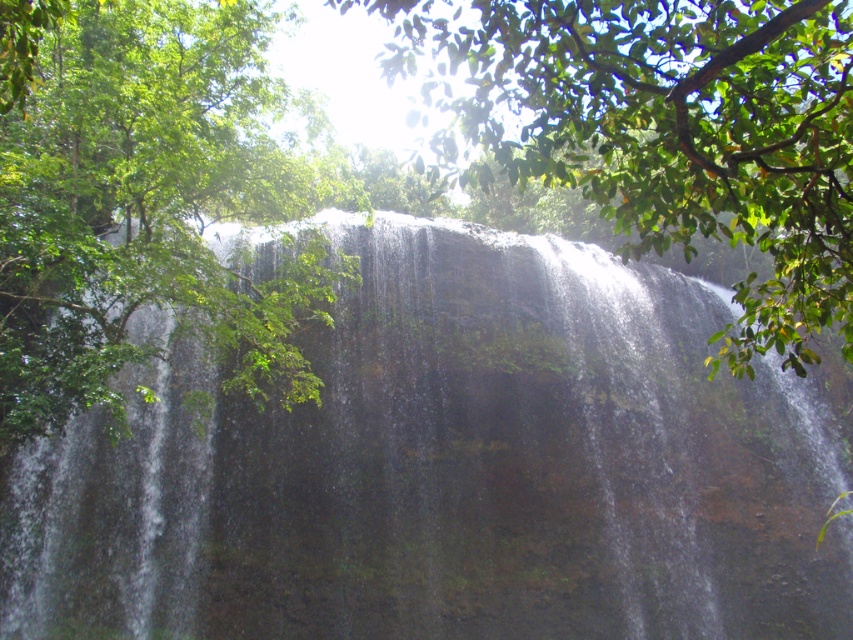
You are a photographer planning to capture the waterfall and the tree in the scene. Which object, the clear water at center or the green leafy tree at upper left, will occupy more space in your photo?

The clear water at center occupies more space in the photo because it is bigger than the green leafy tree at upper left.